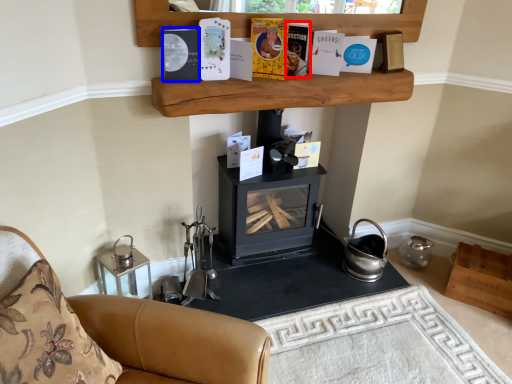
Question: Which object appears closest to the camera in this image, paperback book (highlighted by a red box) or paperback book (highlighted by a blue box)?

Choices:
 (A) paperback book
 (B) paperback book

Answer: (B)